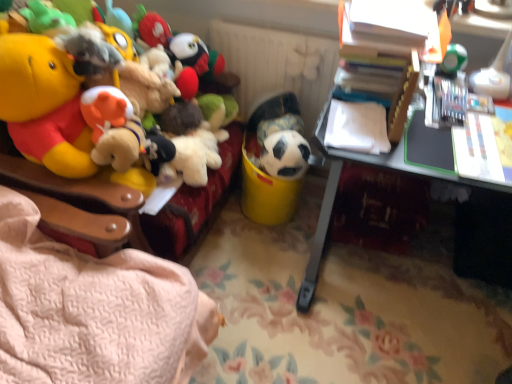
Image resolution: width=512 pixels, height=384 pixels. What are the coordinates of `free space in front of green matte die at upper right, arranged as the fourth toy when viewed from the left` in the screenshot? It's located at (468, 104).